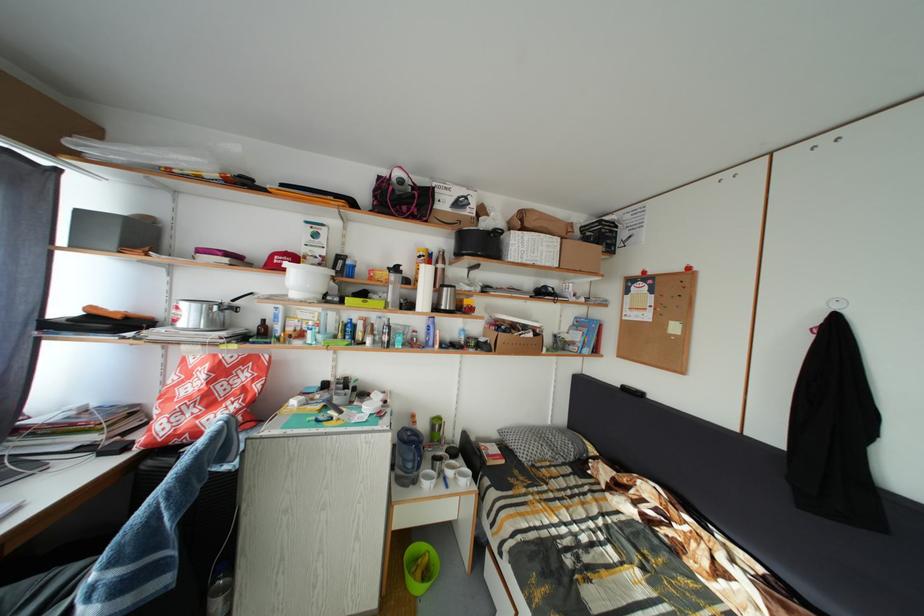
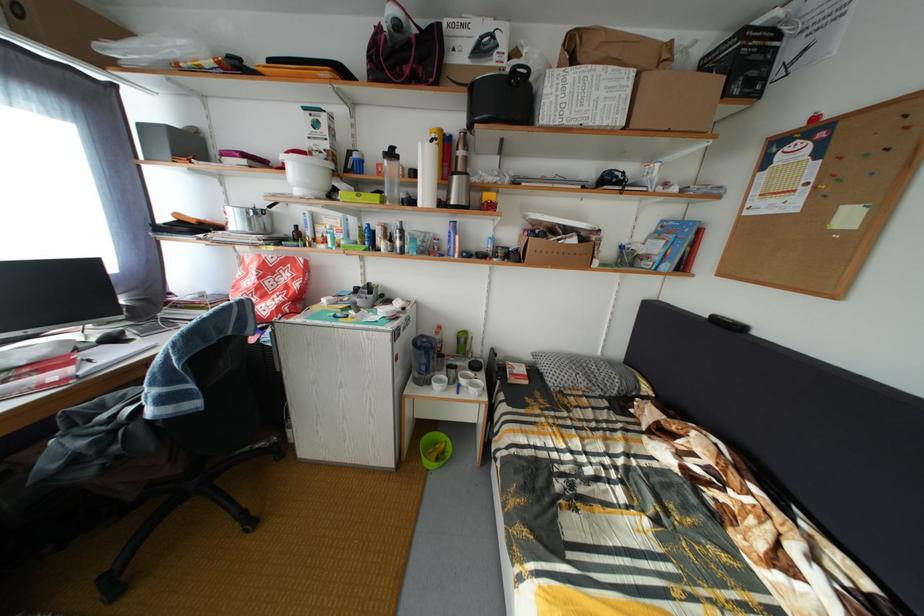
Find the pixel in the second image that matches (455,294) in the first image.

(464, 184)